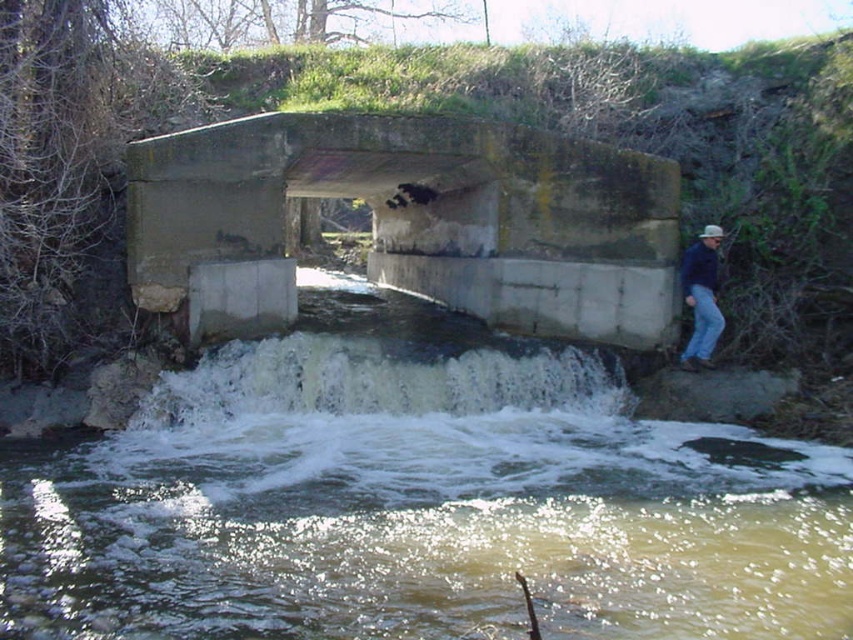
You are standing on the grassy bank near the stream and want to cross to the other side. The concrete bridge at center is in your way. Can you walk around it to reach the white frothy water at center?

The concrete bridge at center is further to the viewer than white frothy water at center, so you cannot walk around it because the bridge is closer to you and blocks your path to the water.

You are standing at the base of the concrete culvert bridge and want to reach a point marked as point (706, 531). If your maximum comfortable walking distance is 20 feet, will you be able to walk to that point without feeling uncomfortable?

The distance of point (706, 531) from camera is 21.19 feet, which exceeds your maximum comfortable walking distance of 20 feet. Therefore, you may feel uncomfortable walking to that point.

You are standing on the grassy bank to the left of the stream. You want to cross to the other side. Which direction should you walk to reach the concrete bridge at center first before the white frothy water at center?

You should walk to the right because the concrete bridge at center is to the right of the white frothy water at center, so moving right will lead you to the bridge before encountering the water.